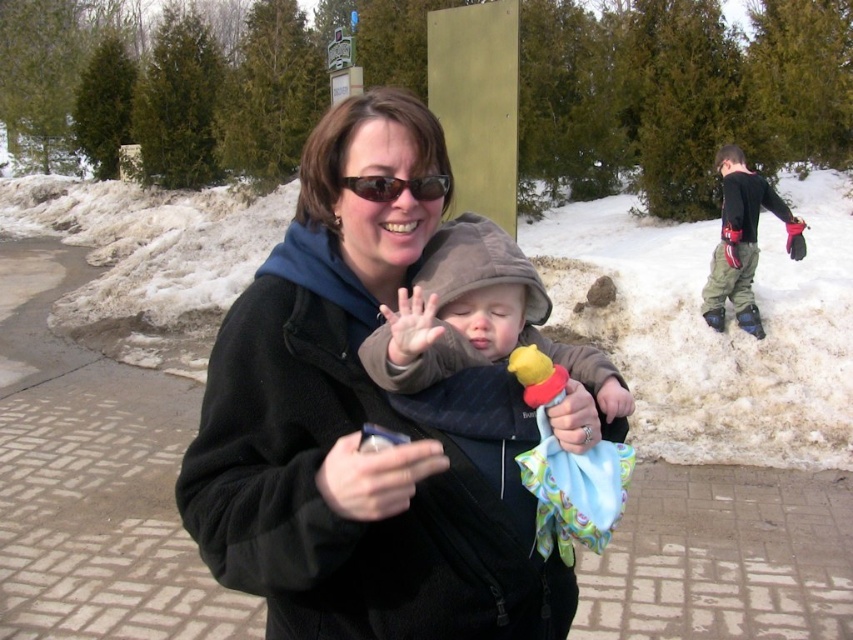
Which is more to the right, dark green pants at right or black matte hand at center?

dark green pants at right

Who is shorter, dark green pants at right or black matte hand at center?

black matte hand at center is shorter.

This screenshot has width=853, height=640. What do you see at coordinates (741, 241) in the screenshot?
I see `dark green pants at right` at bounding box center [741, 241].

This screenshot has height=640, width=853. In order to click on dark green pants at right in this screenshot , I will do `click(741, 241)`.

Can you confirm if black fleece jacket at center is positioned to the left of dark green pants at right?

Indeed, black fleece jacket at center is positioned on the left side of dark green pants at right.

Which is in front, point (247, 371) or point (730, 211)?

Positioned in front is point (247, 371).

Which is in front, point (283, 452) or point (701, 308)?

Positioned in front is point (283, 452).

In order to click on black fleece jacket at center in this screenshot , I will do `click(361, 422)`.

Does brown fleece jacket at center appear on the right side of matte black sunglasses at center?

Correct, you'll find brown fleece jacket at center to the right of matte black sunglasses at center.

Is brown fleece jacket at center above matte black sunglasses at center?

Actually, brown fleece jacket at center is below matte black sunglasses at center.

Does point (503, 323) come closer to viewer compared to point (387, 180)?

No, (503, 323) is behind (387, 180).

At what (x,y) coordinates should I click in order to perform the action: click on brown fleece jacket at center. Please return your answer as a coordinate pair (x, y). The height and width of the screenshot is (640, 853). Looking at the image, I should click on (477, 317).